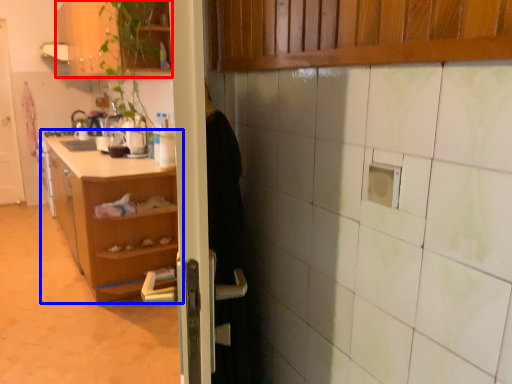
Question: Which object appears closest to the camera in this image, cabinetry (highlighted by a red box) or shelf (highlighted by a blue box)?

Choices:
 (A) cabinetry
 (B) shelf

Answer: (A)